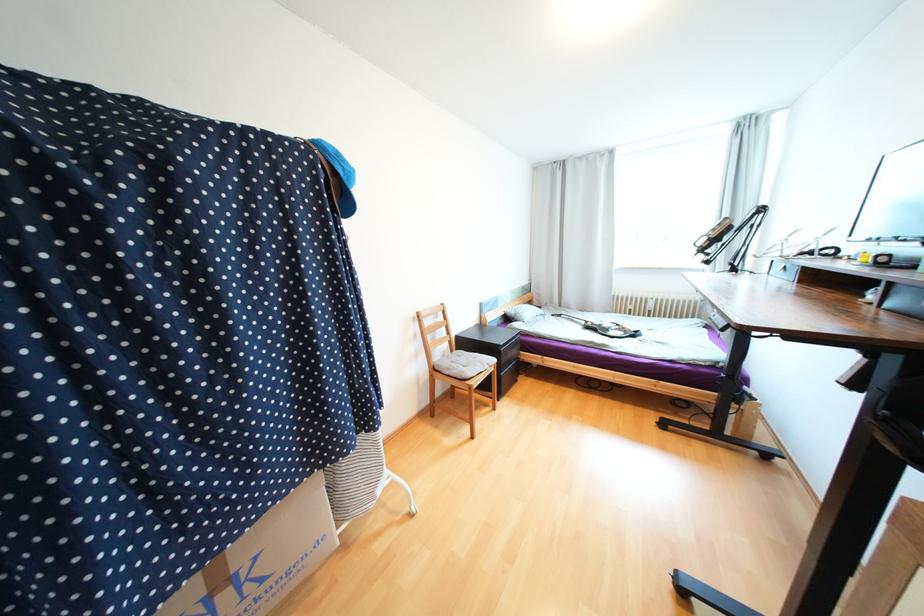
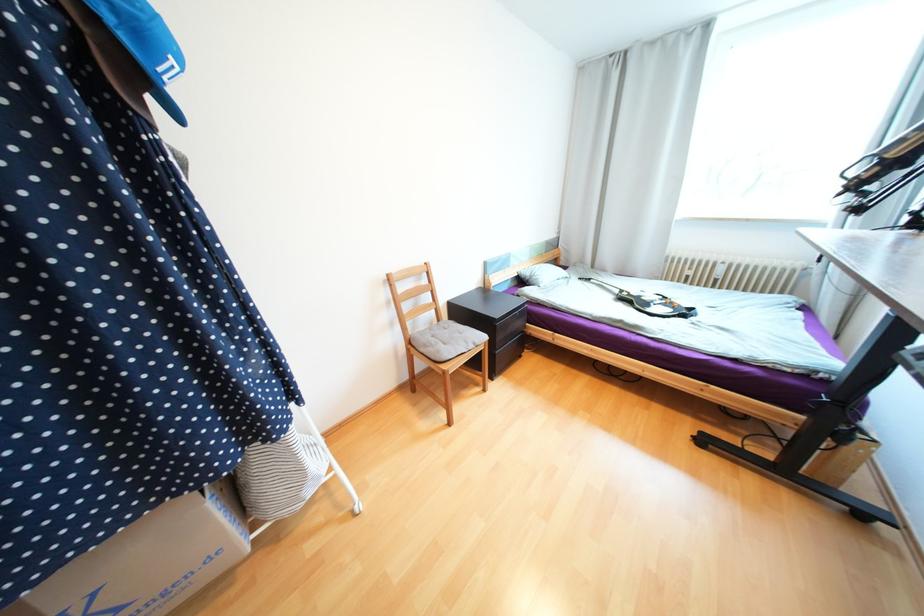
What movement of the cameraman would produce the second image?

The cameraman moved toward right, forward.